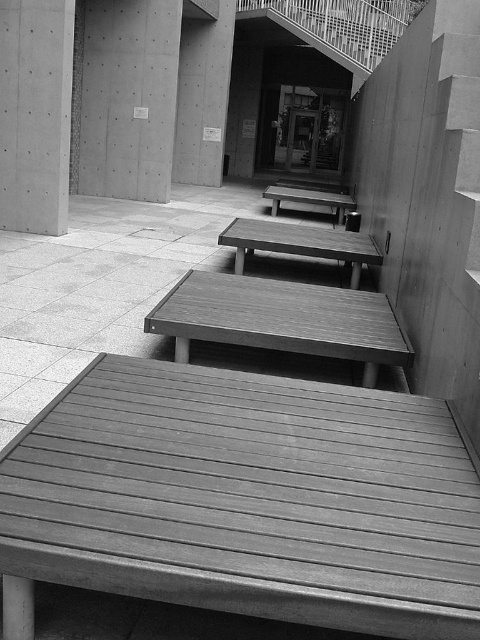
You are standing at the entrance of the building and see two points marked in the scene. The first point is at coordinate point (219, 314) and the second is at point (27, 211). Which point is closer to you as you face the entrance?

Point (219, 314) is in front of point (27, 211), so it is closer to you as you face the entrance.

You are standing in the architectural space and want to place a small potted plant between the wooden table at center and the smooth concrete pillar at upper left. Which object should the plant be closer to if it needs to be near the entrance?

The wooden table at center is closer to the viewer than the smooth concrete pillar at upper left, so placing the plant closer to the wooden table at center would position it nearer to the entrance.